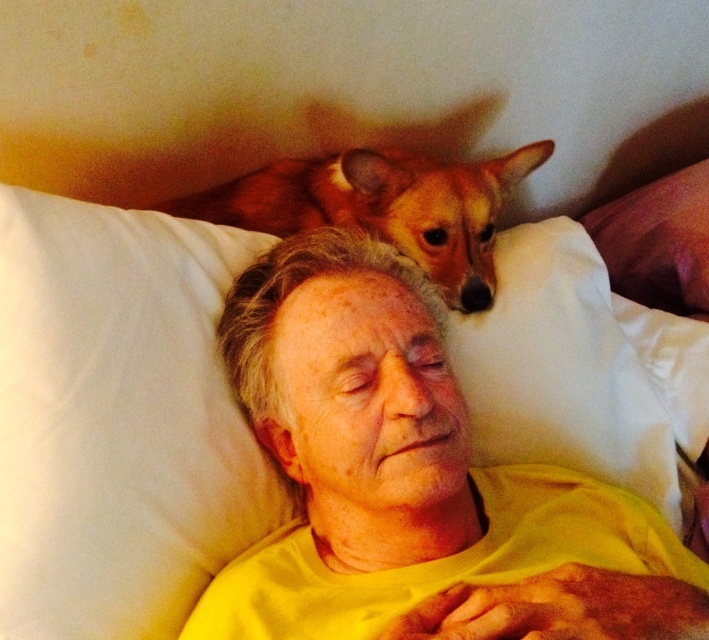
Question: Can you confirm if white soft pillow at upper center is bigger than brown fur dog at upper center?

Choices:
 (A) yes
 (B) no

Answer: (B)

Question: Which object is the closest to the white soft pillow at upper left?

Choices:
 (A) brown fur dog at upper center
 (B) yellow matte shirt at center
 (C) white soft pillow at upper center

Answer: (B)

Question: Is yellow matte shirt at center smaller than brown fur dog at upper center?

Choices:
 (A) yes
 (B) no

Answer: (B)

Question: Considering the relative positions of yellow matte shirt at center and brown fur dog at upper center in the image provided, where is yellow matte shirt at center located with respect to brown fur dog at upper center?

Choices:
 (A) right
 (B) left

Answer: (A)

Question: Which of the following is the farthest from the observer?

Choices:
 (A) brown fur dog at upper center
 (B) white soft pillow at upper center
 (C) yellow matte shirt at center

Answer: (A)

Question: Considering the real-world distances, which object is closest to the yellow matte shirt at center?

Choices:
 (A) white soft pillow at upper left
 (B) brown fur dog at upper center

Answer: (A)